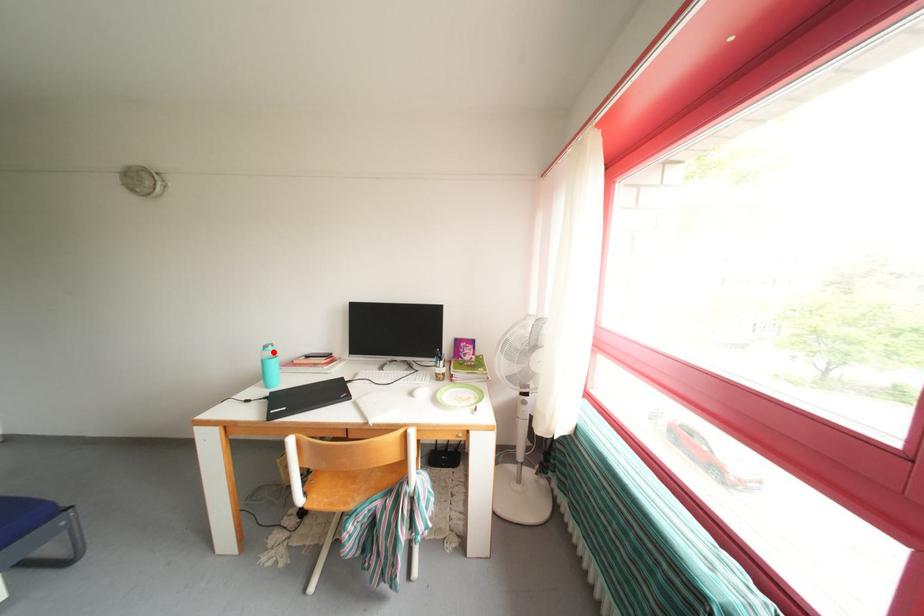
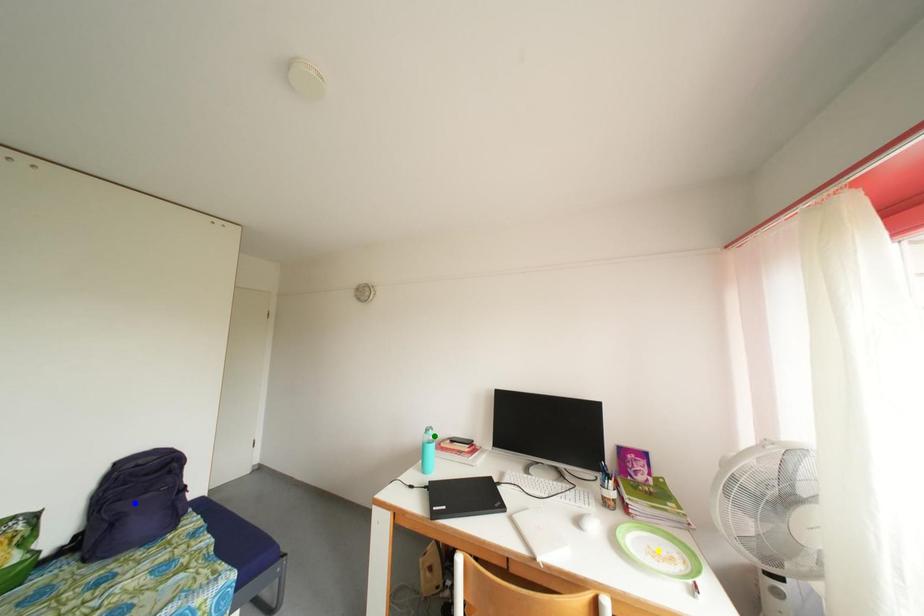
Question: I am providing you with two images of the same scene from different viewpoints. A red point is marked on the first image. You are given multiple points on the second image. Which point in image 2 represents the same 3d spot as the red point in image 1?

Choices:
 (A) yellow point
 (B) green point
 (C) blue point

Answer: (B)